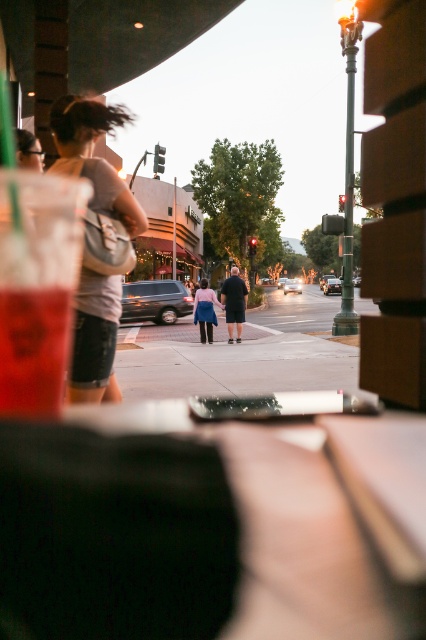
You are standing at the crosswalk in the image and want to locate the matte gray backpack at left. According to the coordinates given, where exactly would you look to find it?

The matte gray backpack at left is located at coordinates point (x=94, y=156).

You are standing at the crosswalk holding a 7.5 feet long ladder. You need to place it against the matte gray backpack at left. Is the ladder long enough to reach the backpack?

The matte gray backpack at left is 7.84 feet away from the camera. Since the ladder is only 7.5 feet long, it is not long enough to reach the backpack.

You are standing at the point with coordinates point (x=193, y=308) and want to walk to the point with coordinates point (x=36, y=372). According to the scene, which direction should you move relative to your current position?

You should move forward because point (x=36, y=372) is in front of point (x=193, y=308).